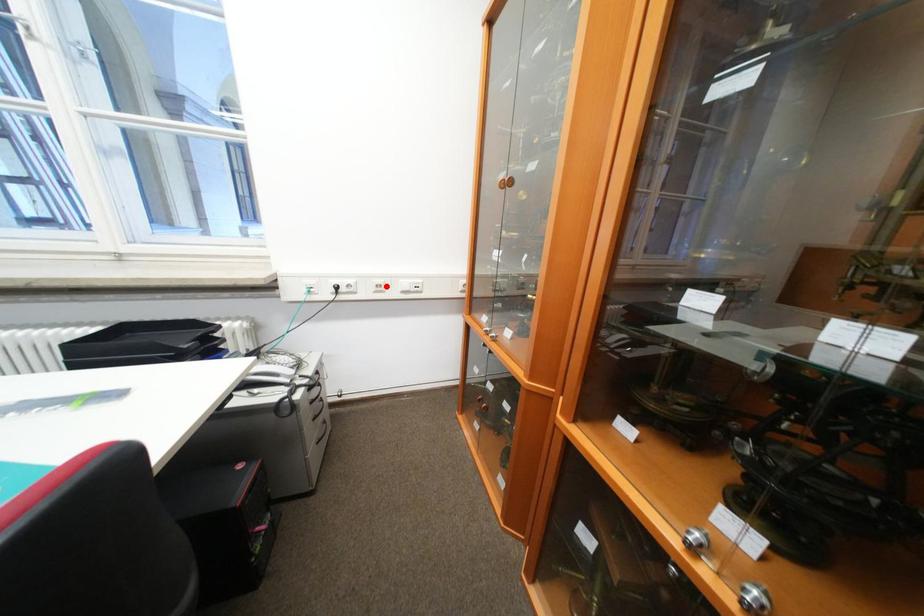
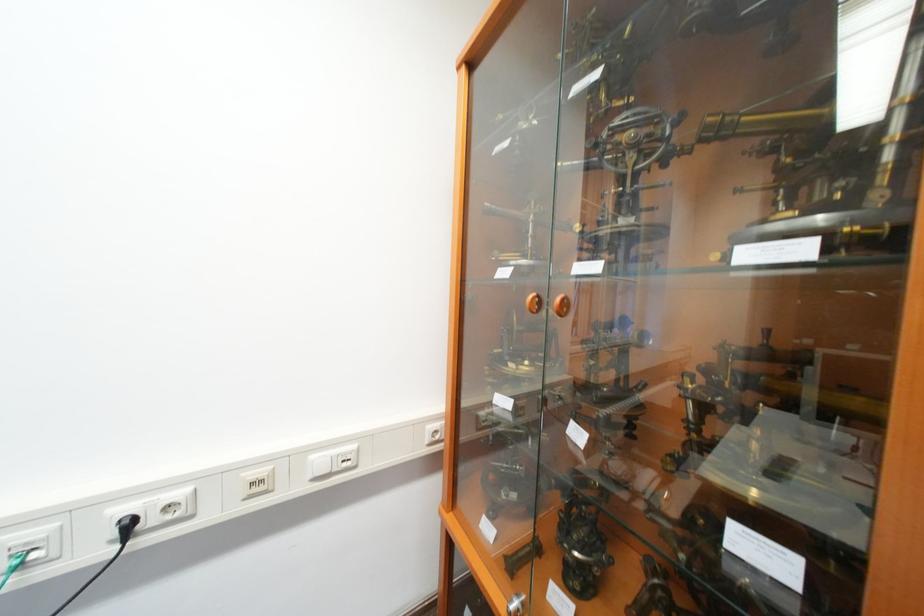
Where in the second image is the point corresponding to the highlighted location from the first image?

(261, 485)